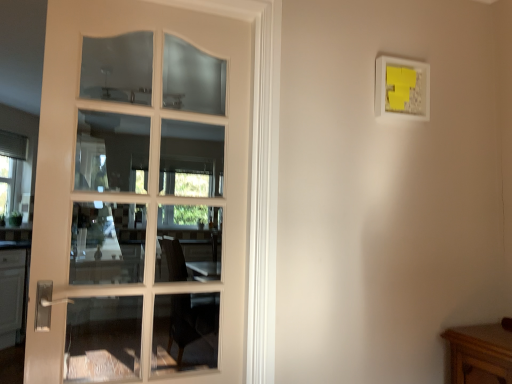
What is the approximate width of white glossy door at left?

white glossy door at left is 11.77 centimeters in width.

Identify the location of white glossy door at left. The height and width of the screenshot is (384, 512). (74, 152).

Is wooden table at lower right oriented towards white matte picture frame at upper right?

No.

From the image's perspective, is wooden table at lower right located above white matte picture frame at upper right?

No, from the image's perspective, wooden table at lower right is not on top of white matte picture frame at upper right.

Which object is closer to the camera, wooden table at lower right or white matte picture frame at upper right?

wooden table at lower right.

Is wooden table at lower right beside white matte picture frame at upper right?

No.

Between white glossy door at left and white matte picture frame at upper right, which one appears on the left side from the viewer's perspective?

From the viewer's perspective, white glossy door at left appears more on the left side.

Can you confirm if white glossy door at left is shorter than white matte picture frame at upper right?

In fact, white glossy door at left may be taller than white matte picture frame at upper right.

Is white glossy door at left aimed at white matte picture frame at upper right?

No, white glossy door at left is not oriented towards white matte picture frame at upper right.

From the image's perspective, which one is positioned higher, white glossy door at left or white matte picture frame at upper right?

white matte picture frame at upper right appears higher in the image.

From the image's perspective, is wooden table at lower right positioned above or below white glossy door at left?

wooden table at lower right is situated lower than white glossy door at left in the image.

Which is in front, point (452, 350) or point (58, 294)?

The point (58, 294) is more forward.

Who is bigger, wooden table at lower right or white glossy door at left?

white glossy door at left is bigger.

Is wooden table at lower right far from white glossy door at left?

Yes.

Are white glossy door at left and wooden table at lower right beside each other?

white glossy door at left is not next to wooden table at lower right, and they're not touching.

Where is `table that appears below the white glossy door at left (from a real-world perspective)`? The height and width of the screenshot is (384, 512). table that appears below the white glossy door at left (from a real-world perspective) is located at coordinates (480, 354).

Which object is thinner, white glossy door at left or wooden table at lower right?

With smaller width is white glossy door at left.

Looking at this image, which is farther from the camera, (238,214) or (505,376)?

Point (238,214)

From a real-world perspective, is white matte picture frame at upper right physically above white glossy door at left?

Yes, from a real-world perspective, white matte picture frame at upper right is over white glossy door at left

Considering the positions of objects white matte picture frame at upper right and white glossy door at left in the image provided, who is more to the left, white matte picture frame at upper right or white glossy door at left?

From the viewer's perspective, white glossy door at left appears more on the left side.

How many degrees apart are the facing directions of white matte picture frame at upper right and white glossy door at left?

The facing directions of white matte picture frame at upper right and white glossy door at left are 0.456 degrees apart.

From the image's perspective, between white matte picture frame at upper right and white glossy door at left, which one is located above?

white matte picture frame at upper right is shown above in the image.

Does white matte picture frame at upper right come behind wooden table at lower right?

Yes, white matte picture frame at upper right is behind wooden table at lower right.

Is white matte picture frame at upper right oriented towards wooden table at lower right?

No, white matte picture frame at upper right is not turned towards wooden table at lower right.

From a real-world perspective, is white matte picture frame at upper right physically above wooden table at lower right?

Indeed, from a real-world perspective, white matte picture frame at upper right stands above wooden table at lower right.

How much distance is there between white matte picture frame at upper right and wooden table at lower right?

white matte picture frame at upper right and wooden table at lower right are 1.03 meters apart from each other.

Find the location of a particular element. table beneath the white matte picture frame at upper right (from a real-world perspective) is located at coordinates (480, 354).

Where is `door that appears below the white matte picture frame at upper right (from the image's perspective)`? This screenshot has height=384, width=512. door that appears below the white matte picture frame at upper right (from the image's perspective) is located at coordinates (74, 152).

From the image, which object appears to be farther from white matte picture frame at upper right, wooden table at lower right or white glossy door at left?

wooden table at lower right lies further to white matte picture frame at upper right than the other object.

When comparing their distances from white glossy door at left, does wooden table at lower right or white matte picture frame at upper right seem further?

The object further to white glossy door at left is wooden table at lower right.

Based on their spatial positions, is white glossy door at left or white matte picture frame at upper right further from wooden table at lower right?

The object further to wooden table at lower right is white glossy door at left.

When comparing their distances from white matte picture frame at upper right, does white glossy door at left or wooden table at lower right seem further?

Based on the image, wooden table at lower right appears to be further to white matte picture frame at upper right.

From the picture: Estimate the real-world distances between objects in this image. Which object is closer to white glossy door at left, white matte picture frame at upper right or wooden table at lower right?

white matte picture frame at upper right is positioned closer to the anchor white glossy door at left.

Based on their spatial positions, is white matte picture frame at upper right or white glossy door at left further from wooden table at lower right?

white glossy door at left is further to wooden table at lower right.

What are the coordinates of `picture frame located between white glossy door at left and wooden table at lower right in the left-right direction` in the screenshot? It's located at (401, 89).